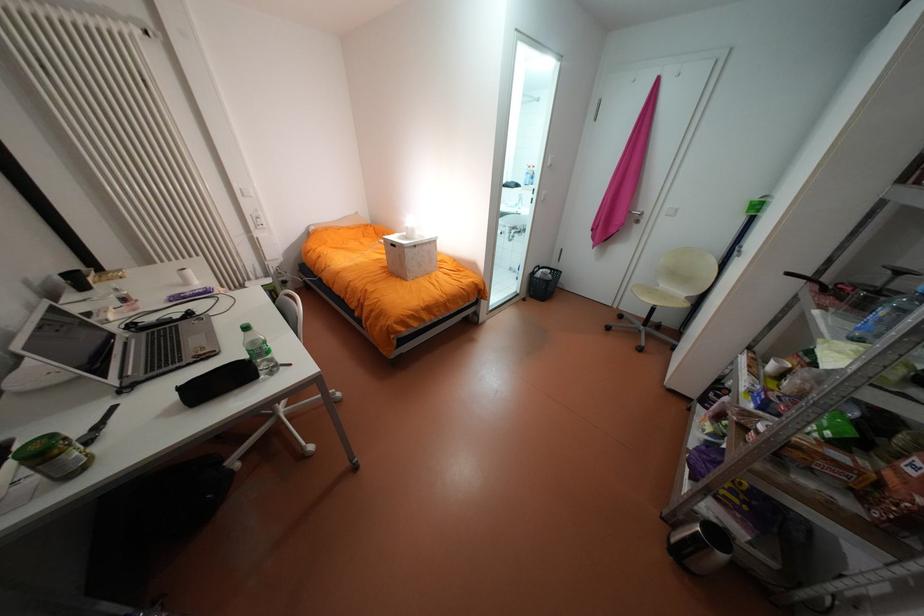
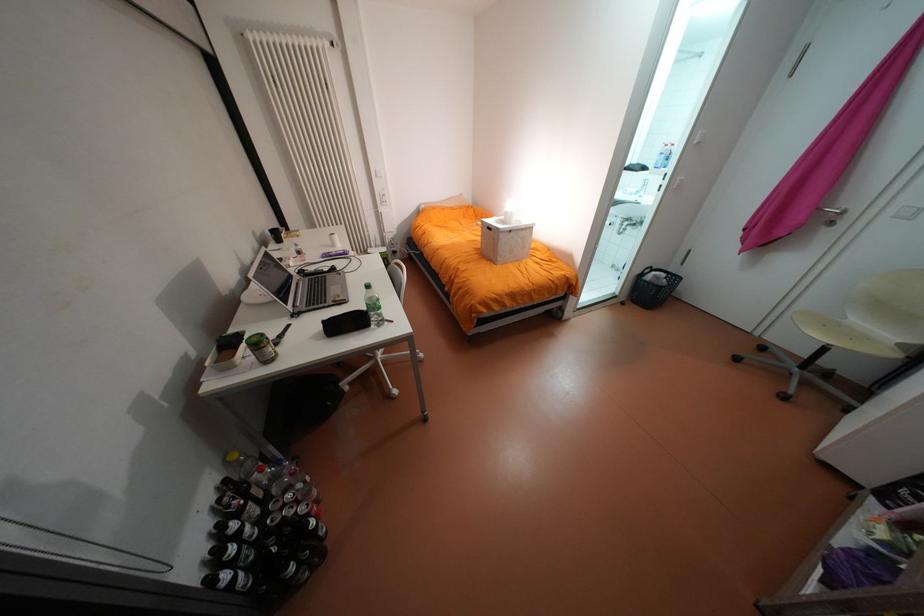
The point at (266, 376) is marked in the first image. Where is the corresponding point in the second image?

(379, 325)